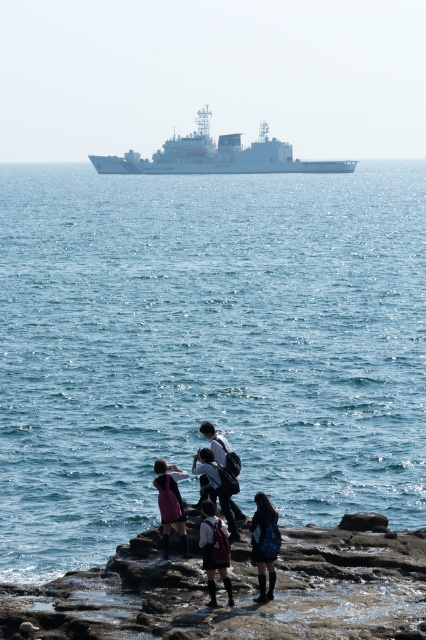
Question: Is dark blue denim skirt at center in front of pink fabric dress at lower center?

Choices:
 (A) no
 (B) yes

Answer: (B)

Question: Based on their relative distances, which object is farther from the dark blue denim skirt at center?

Choices:
 (A) white cotton shirt at center
 (B) white matte ship at upper center
 (C) blue denim skirt at lower center

Answer: (B)

Question: Based on their relative distances, which object is nearer to the rugged stone coast at lower center?

Choices:
 (A) blue water at center
 (B) white matte ship at upper center
 (C) blue denim skirt at lower center

Answer: (C)

Question: Can you confirm if blue denim skirt at lower center is thinner than pink fabric dress at lower center?

Choices:
 (A) no
 (B) yes

Answer: (B)

Question: Which point is farther to the camera?

Choices:
 (A) white matte ship at upper center
 (B) pink fabric dress at lower center
 (C) white cotton shirt at center

Answer: (A)

Question: Does dark blue denim skirt at center appear over white cotton shirt at center?

Choices:
 (A) no
 (B) yes

Answer: (A)